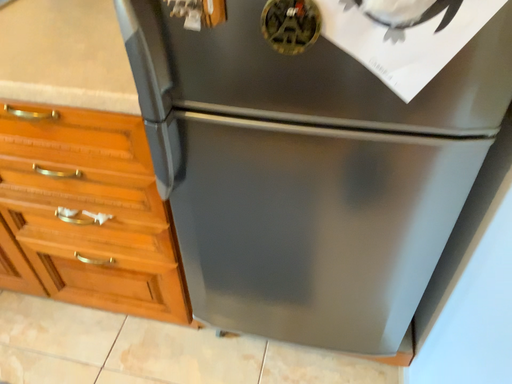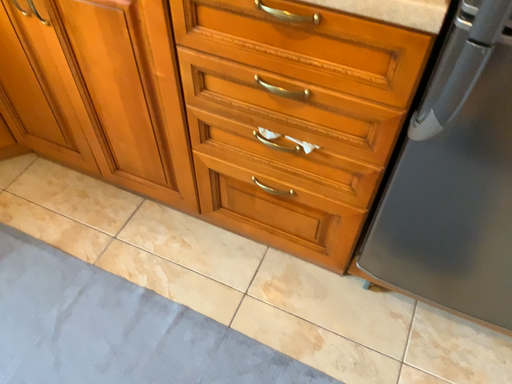
Question: Which way did the camera rotate in the video?

Choices:
 (A) rotated right
 (B) rotated left

Answer: (B)